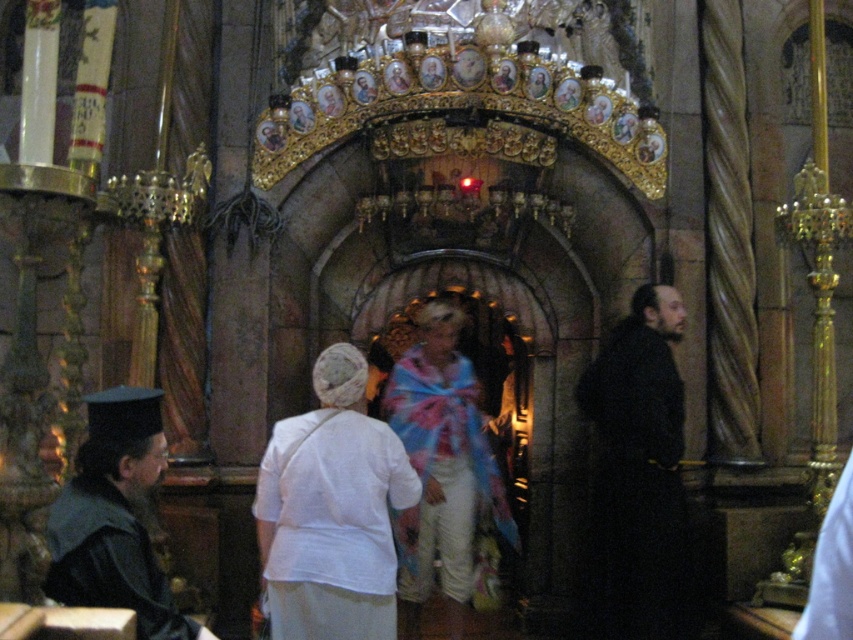
You are standing in the ceremonial space and want to move from the point at coordinate (653, 628) to the point at coordinate (432, 536). Given that the path between them is clear, will you be moving towards the front or the back of the space?

Since point (653, 628) is in front of point (432, 536), moving from the former to the latter would mean moving towards the back of the space.